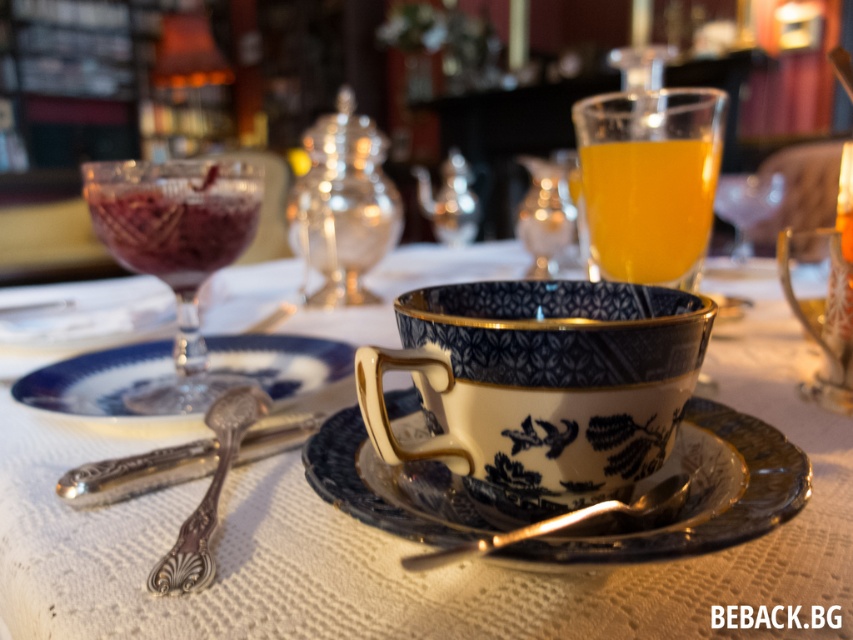
Question: Among these objects, which one is nearest to the camera?

Choices:
 (A) blue porcelain teacup at center
 (B) silver polished spoon at lower left
 (C) polished silver spoon at center
 (D) blue ceramic saucer at center

Answer: (D)

Question: Does polished silver spoon at center have a larger size compared to gold metallic spoon at center?

Choices:
 (A) yes
 (B) no

Answer: (A)

Question: Which point is closer to the camera taking this photo?

Choices:
 (A) (119, 241)
 (B) (577, 481)
 (C) (440, 525)

Answer: (C)

Question: Can you confirm if blue porcelain teacup at center is thinner than blue ceramic saucer at center?

Choices:
 (A) no
 (B) yes

Answer: (B)

Question: Which object is the farthest from the blue porcelain teacup at center?

Choices:
 (A) transparent glass bowl at left
 (B) blue ceramic saucer at center
 (C) white porcelain cup at center

Answer: (C)

Question: Is blue porcelain teacup at center further to the viewer compared to translucent glass at upper right?

Choices:
 (A) no
 (B) yes

Answer: (A)